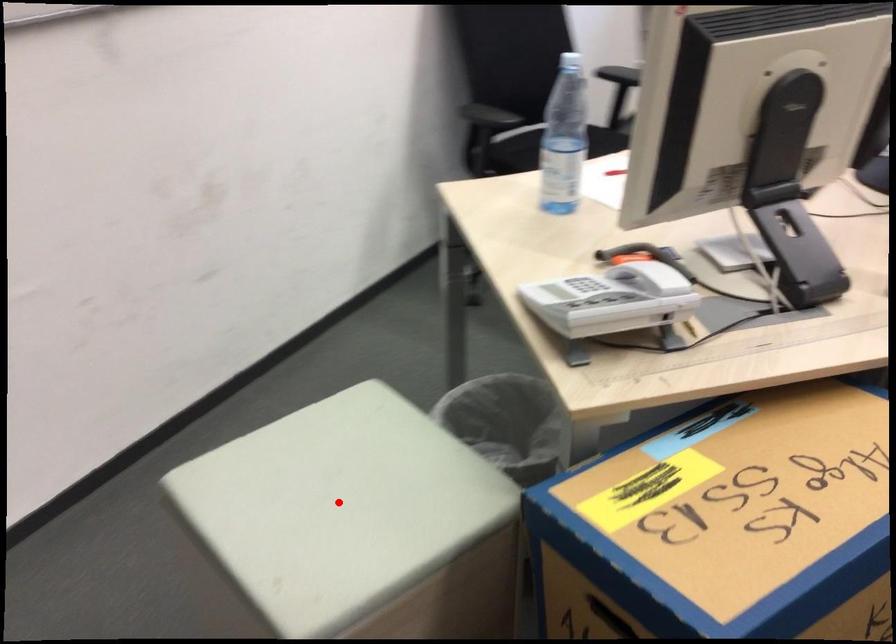
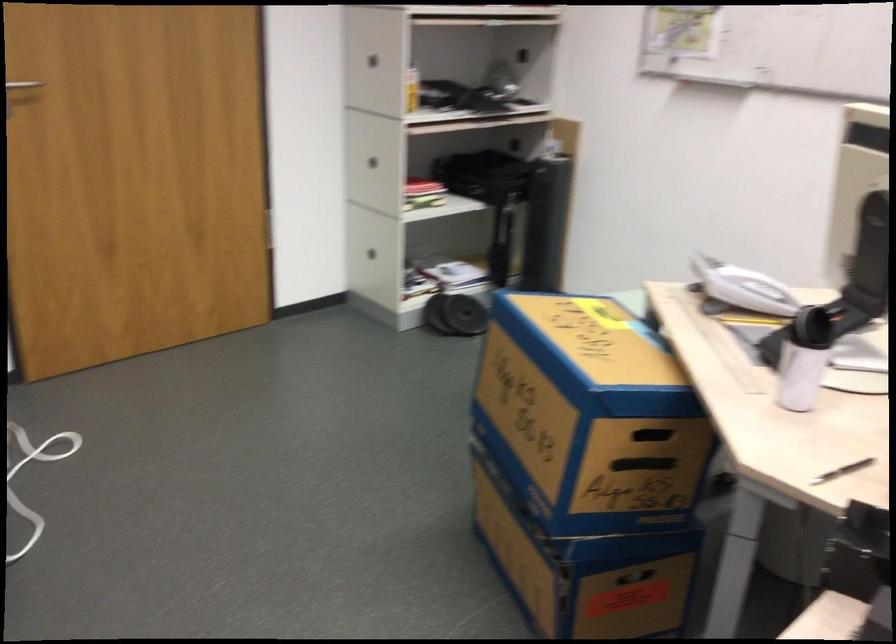
Question: I am providing you with two images of the same scene from different viewpoints. A red point is marked on the first image. Is the red point's position out of view in image 2?

Choices:
 (A) Yes
 (B) No

Answer: (A)